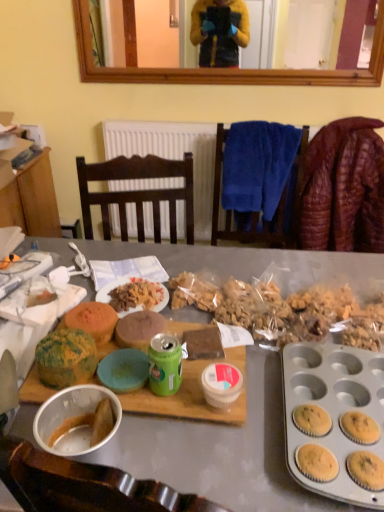
Question: Does matte gray desk at center lie behind leather jacket at right?

Choices:
 (A) yes
 (B) no

Answer: (B)

Question: Could you tell me if matte gray desk at center is facing leather jacket at right?

Choices:
 (A) no
 (B) yes

Answer: (B)

Question: Is matte gray desk at center closer to camera compared to leather jacket at right?

Choices:
 (A) yes
 (B) no

Answer: (A)

Question: Are matte gray desk at center and leather jacket at right making contact?

Choices:
 (A) no
 (B) yes

Answer: (A)

Question: Can leather jacket at right be found inside matte gray desk at center?

Choices:
 (A) no
 (B) yes

Answer: (A)

Question: Is green matte muffin at center-left, which is the 1th snack from back to front, in front of or behind matte plastic plate at center in the image?

Choices:
 (A) front
 (B) behind

Answer: (A)

Question: Is green matte muffin at center-left, which is the 1th snack from back to front, inside or outside of matte plastic plate at center?

Choices:
 (A) outside
 (B) inside

Answer: (A)

Question: Considering the positions of green matte muffin at center-left, the 2th snack in the front-to-back sequence, and matte plastic plate at center in the image, is green matte muffin at center-left, the 2th snack in the front-to-back sequence, taller or shorter than matte plastic plate at center?

Choices:
 (A) short
 (B) tall

Answer: (B)

Question: In the image, is green matte muffin at center-left, which is the 1th snack from back to front, on the left side or the right side of matte plastic plate at center?

Choices:
 (A) left
 (B) right

Answer: (A)

Question: Is leather jacket at right inside the boundaries of matte gray desk at center, or outside?

Choices:
 (A) outside
 (B) inside

Answer: (A)

Question: Is leather jacket at right taller or shorter than matte gray desk at center?

Choices:
 (A) short
 (B) tall

Answer: (A)

Question: Is leather jacket at right to the left or to the right of matte gray desk at center in the image?

Choices:
 (A) right
 (B) left

Answer: (A)

Question: Considering their positions, is leather jacket at right located in front of or behind matte gray desk at center?

Choices:
 (A) behind
 (B) front

Answer: (A)

Question: Is point (379, 157) closer or farther from the camera than point (150, 371)?

Choices:
 (A) closer
 (B) farther

Answer: (B)

Question: From a real-world perspective, is leather jacket at right above or below green matte can at center?

Choices:
 (A) below
 (B) above

Answer: (A)